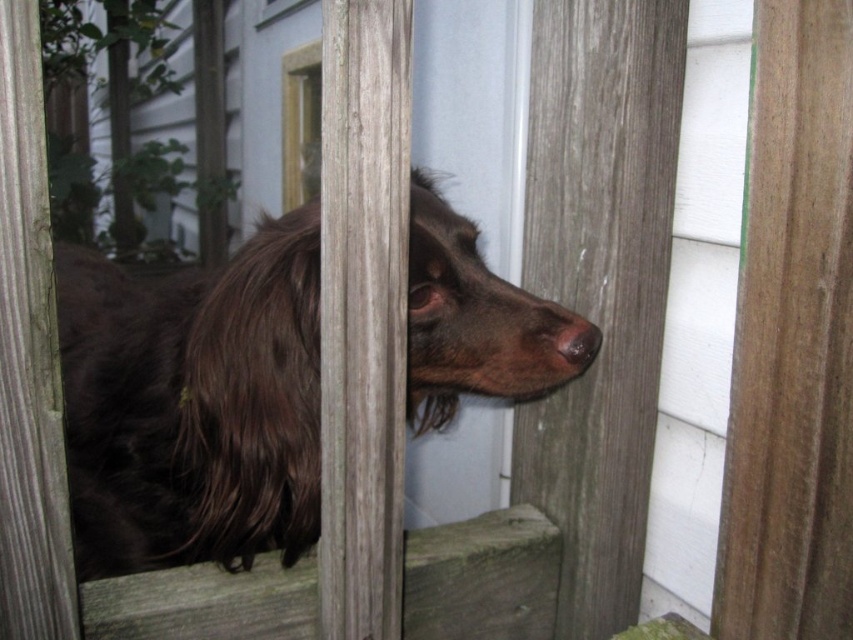
You are a photographer trying to capture the dog behind the fence. You notice the shiny brown fur at center and the brown matte nose at center. Which part of the dog is lower in the image?

The shiny brown fur at center is positioned under the brown matte nose at center, so the shiny brown fur at center is lower in the image.

Looking at the scene with the dog behind the wooden fence, can you determine if the shiny brown fur at center is wider than the brown matte nose at center?

The shiny brown fur at center is wider than the brown matte nose at center according to the description provided.

You are standing at point A, which is at coordinates point A at (532, 353). You want to walk to point B, which is 1.19 meters away from point A. Can you reach point B within 3 steps if each of your steps is 0.5 meters long?

Since each step is 0.5 meters and you need to cover 1.19 meters, 3 steps would give you 1.5 meters, which is more than enough. Yes, you can reach point B within 3 steps.